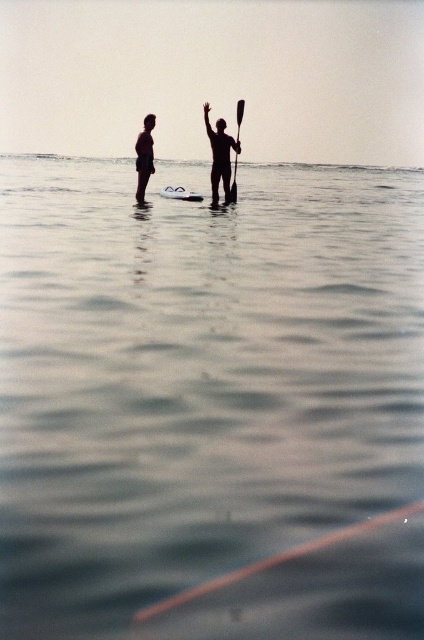
Which is below, silhouette skin at left or white foam surfboard at center?

white foam surfboard at center

Is silhouette skin at left positioned before white foam surfboard at center?

Yes, silhouette skin at left is in front of white foam surfboard at center.

The width and height of the screenshot is (424, 640). Identify the location of silhouette skin at left. (145, 156).

Find the location of a particular element. The height and width of the screenshot is (640, 424). silhouette skin at left is located at coordinates (145, 156).

Who is taller, black matte surfboard at center or black plastic paddle at center?

Standing taller between the two is black matte surfboard at center.

Measure the distance from black matte surfboard at center to black plastic paddle at center.

black matte surfboard at center and black plastic paddle at center are 3.67 feet apart.

Which is in front, point (226, 163) or point (231, 186)?

Point (226, 163) is more forward.

At what (x,y) coordinates should I click in order to perform the action: click on black matte surfboard at center. Please return your answer as a coordinate pair (x, y). The height and width of the screenshot is (640, 424). Looking at the image, I should click on (220, 156).

Locate an element on the screen. Image resolution: width=424 pixels, height=640 pixels. black matte surfboard at center is located at coordinates (220, 156).

Looking at this image, who is positioned more to the left, black matte surfboard at center or white foam surfboard at center?

From the viewer's perspective, white foam surfboard at center appears more on the left side.

Does point (220, 122) lie behind point (189, 195)?

No.

Image resolution: width=424 pixels, height=640 pixels. What are the coordinates of `black matte surfboard at center` in the screenshot? It's located at (220, 156).